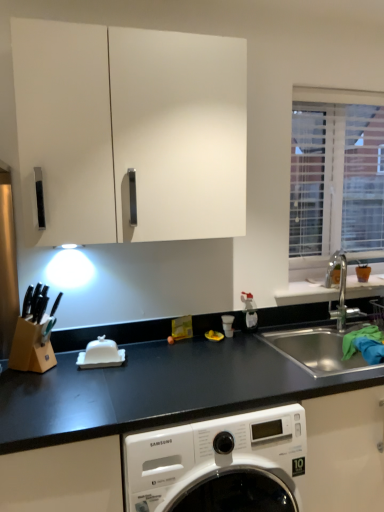
Question: Is stainless steel sink at right at the back of white matte window sill at right?

Choices:
 (A) no
 (B) yes

Answer: (A)

Question: From a real-world perspective, is white matte window sill at right physically below stainless steel sink at right?

Choices:
 (A) yes
 (B) no

Answer: (B)

Question: Considering the relative sizes of white matte window sill at right and stainless steel sink at right in the image provided, is white matte window sill at right shorter than stainless steel sink at right?

Choices:
 (A) yes
 (B) no

Answer: (A)

Question: From the image's perspective, does white matte window sill at right appear lower than stainless steel sink at right?

Choices:
 (A) no
 (B) yes

Answer: (A)

Question: Can you confirm if white matte window sill at right is positioned to the left of stainless steel sink at right?

Choices:
 (A) yes
 (B) no

Answer: (B)

Question: Relative to white glossy butter dish at center, is white matte window sill at right in front or behind?

Choices:
 (A) front
 (B) behind

Answer: (B)

Question: From the image's perspective, is white matte window sill at right located above or below white glossy butter dish at center?

Choices:
 (A) above
 (B) below

Answer: (A)

Question: From a real-world perspective, is white matte window sill at right positioned above or below white glossy butter dish at center?

Choices:
 (A) below
 (B) above

Answer: (B)

Question: Based on their sizes in the image, would you say white matte window sill at right is bigger or smaller than white glossy butter dish at center?

Choices:
 (A) small
 (B) big

Answer: (B)

Question: From a real-world perspective, is black matte countertop at lower center above or below white blinds at upper right?

Choices:
 (A) above
 (B) below

Answer: (B)

Question: Considering the positions of black matte countertop at lower center and white blinds at upper right in the image, is black matte countertop at lower center wider or thinner than white blinds at upper right?

Choices:
 (A) wide
 (B) thin

Answer: (A)

Question: Considering the relative positions of black matte countertop at lower center and white blinds at upper right in the image provided, is black matte countertop at lower center to the left or to the right of white blinds at upper right?

Choices:
 (A) right
 (B) left

Answer: (B)

Question: From the image's perspective, relative to white blinds at upper right, is black matte countertop at lower center above or below?

Choices:
 (A) below
 (B) above

Answer: (A)

Question: Considering the relative positions of white blinds at upper right and black matte countertop at lower center in the image provided, is white blinds at upper right to the left or to the right of black matte countertop at lower center?

Choices:
 (A) left
 (B) right

Answer: (B)

Question: From a real-world perspective, is white blinds at upper right above or below black matte countertop at lower center?

Choices:
 (A) above
 (B) below

Answer: (A)